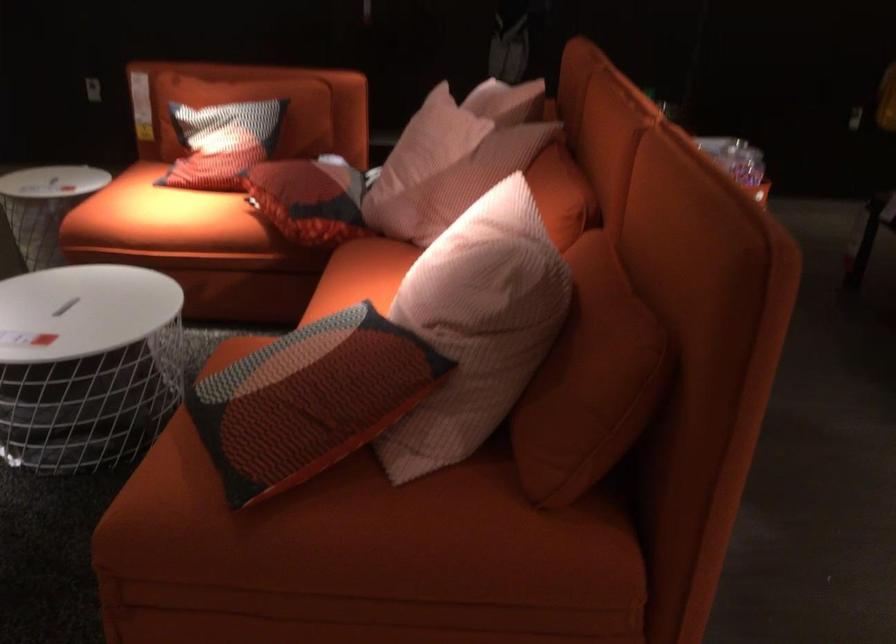
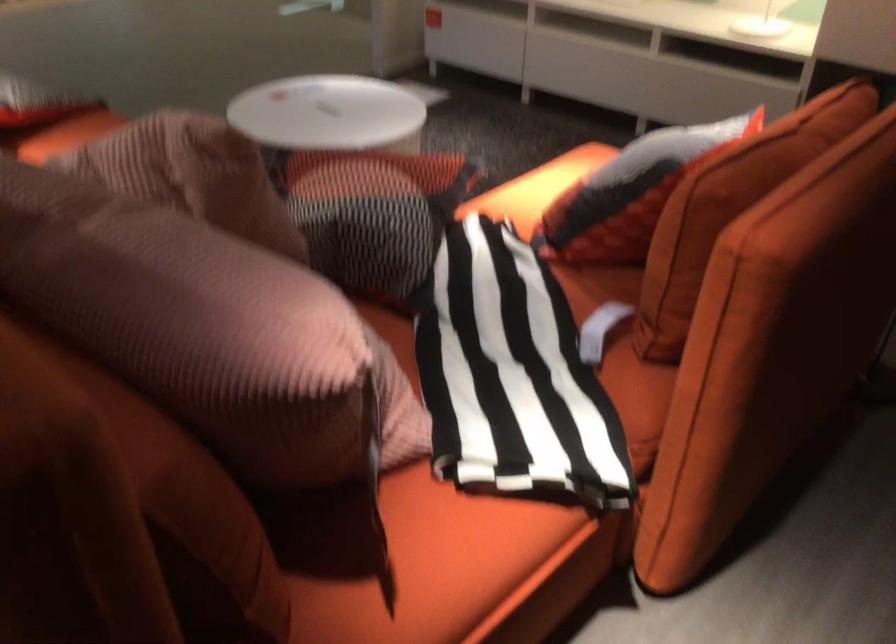
Locate, in the second image, the point that corresponds to (326,90) in the first image.

(730, 207)